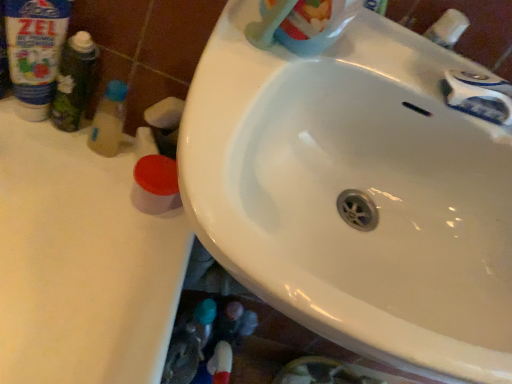
Question: Does translucent plastic bottle at left, the 1th toiletry viewed from the right, have a greater height compared to green matte bottle at left, acting as the first toiletry starting from the left?

Choices:
 (A) yes
 (B) no

Answer: (B)

Question: From the image's perspective, is translucent plastic bottle at left, the 1th toiletry viewed from the right, located beneath green matte bottle at left, the second toiletry in the right-to-left sequence?

Choices:
 (A) no
 (B) yes

Answer: (B)

Question: From a real-world perspective, is translucent plastic bottle at left, marked as the second toiletry in a left-to-right arrangement, on green matte bottle at left, the second toiletry in the right-to-left sequence?

Choices:
 (A) yes
 (B) no

Answer: (B)

Question: From the image's perspective, is translucent plastic bottle at left, marked as the second toiletry in a left-to-right arrangement, over green matte bottle at left, the second toiletry in the right-to-left sequence?

Choices:
 (A) yes
 (B) no

Answer: (B)

Question: Considering the relative positions of translucent plastic bottle at left, marked as the second toiletry in a left-to-right arrangement, and green matte bottle at left, the second toiletry in the right-to-left sequence, in the image provided, is translucent plastic bottle at left, marked as the second toiletry in a left-to-right arrangement, to the right of green matte bottle at left, the second toiletry in the right-to-left sequence, from the viewer's perspective?

Choices:
 (A) yes
 (B) no

Answer: (A)

Question: Considering the positions of point (53, 64) and point (441, 41), is point (53, 64) closer or farther from the camera than point (441, 41)?

Choices:
 (A) closer
 (B) farther

Answer: (B)

Question: In the image, is blue plastic bottle at upper left, which is the first cleaning product in left-to-right order, on the left side or the right side of white plastic faucet at upper right?

Choices:
 (A) left
 (B) right

Answer: (A)

Question: From a real-world perspective, is blue plastic bottle at upper left, positioned as the first cleaning product in back-to-front order, above or below white plastic faucet at upper right?

Choices:
 (A) above
 (B) below

Answer: (B)

Question: From the image's perspective, is blue plastic bottle at upper left, which is the first cleaning product in left-to-right order, positioned above or below white plastic faucet at upper right?

Choices:
 (A) above
 (B) below

Answer: (B)

Question: Is white plastic faucet at upper right taller or shorter than translucent plastic bottle at left, marked as the second toiletry in a left-to-right arrangement?

Choices:
 (A) short
 (B) tall

Answer: (A)

Question: From the image's perspective, is white plastic faucet at upper right located above or below translucent plastic bottle at left, the 1th toiletry viewed from the right?

Choices:
 (A) below
 (B) above

Answer: (B)

Question: Considering their positions, is white plastic faucet at upper right located in front of or behind translucent plastic bottle at left, the 1th toiletry viewed from the right?

Choices:
 (A) behind
 (B) front

Answer: (B)

Question: Is point (459, 16) positioned closer to the camera than point (124, 86)?

Choices:
 (A) farther
 (B) closer

Answer: (B)

Question: Is white glossy sink at center inside the boundaries of blue plastic bottle at upper left, positioned as the first cleaning product in back-to-front order, or outside?

Choices:
 (A) inside
 (B) outside

Answer: (B)

Question: Based on their positions, is white glossy sink at center located to the left or right of blue plastic bottle at upper left, positioned as the second cleaning product in right-to-left order?

Choices:
 (A) right
 (B) left

Answer: (A)